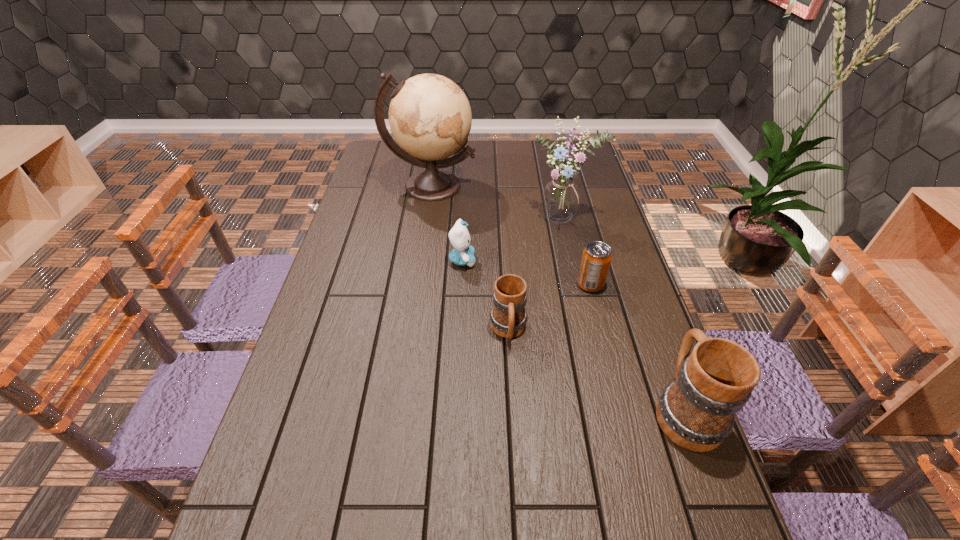
Find the location of a particular element. Image resolution: width=960 pixels, height=540 pixels. free space between the fourth nearest object and the globe is located at coordinates (446, 223).

Find the location of a particular element. free space between the kitten and the fourth object from right to left is located at coordinates (486, 295).

Image resolution: width=960 pixels, height=540 pixels. I want to click on unoccupied position between the left mug and the fourth farthest object, so click(x=549, y=307).

Locate an element on the screen. This screenshot has height=540, width=960. vacant space in between the bouquet and the soda can is located at coordinates (577, 252).

The height and width of the screenshot is (540, 960). I want to click on vacant point located between the fourth shortest object and the globe, so click(558, 298).

Identify the location of free point between the soda can and the globe. The width and height of the screenshot is (960, 540). (511, 235).

You are a GUI agent. You are given a task and a screenshot of the screen. Output one action in this format:
    pyautogui.click(x=<x>, y=<y>)
    Task: Click on the object that can be found as the third closest to the globe
    
    Given the screenshot: What is the action you would take?
    pyautogui.click(x=596, y=258)

This screenshot has height=540, width=960. Identify the location of object identified as the fourth closest to the bouquet. (508, 317).

The image size is (960, 540). What are the coordinates of `blank area in the image that satisfies the following two spatial constraints: 1. on the front-facing side of the bouquet; 2. on the face of the kitten` in the screenshot? It's located at 573,260.

At what (x,y) coordinates should I click in order to perform the action: click on vacant space that satisfies the following two spatial constraints: 1. on the face of the fourth nearest object; 2. on the side of the taller mug with the handle. Please return your answer as a coordinate pair (x, y). Looking at the image, I should click on (456, 409).